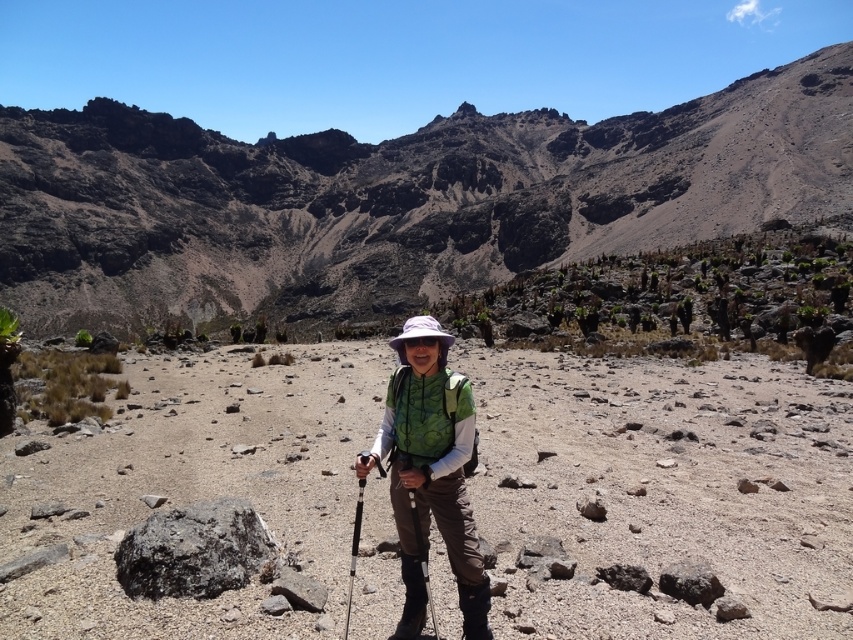
You are a hiker trying to assess the terrain. You notice the brown rocky desert at center and the silver metallic ski pole at center. Which object is taller?

The brown rocky desert at center is taller than the silver metallic ski pole at center.

You are a hiker trying to choose between two ski poles in your gear. You notice the silver metallic ski pole at center and the matte black ski pole at center. Which one has a wider base?

The silver metallic ski pole at center is wider than the matte black ski pole at center according to the description.